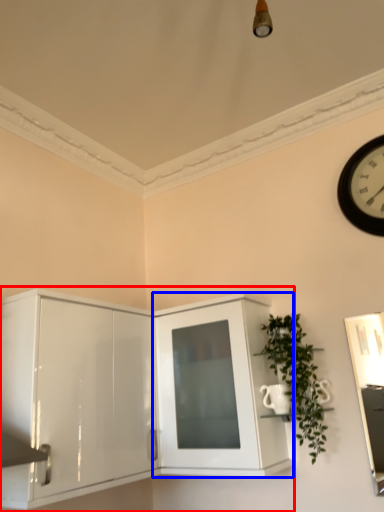
Question: Which of the following is the closest to the observer, cabinetry (highlighted by a red box) or cabinetry (highlighted by a blue box)?

Choices:
 (A) cabinetry
 (B) cabinetry

Answer: (A)